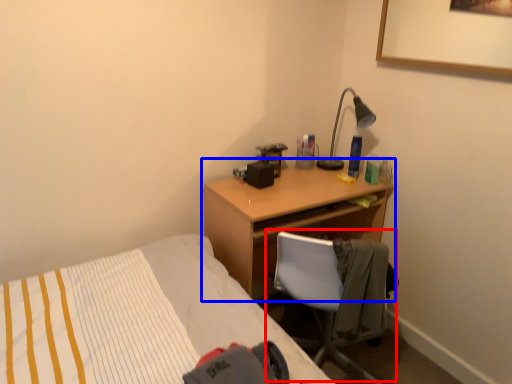
Question: Which of the following is the farthest to the observer, chair (highlighted by a red box) or desk (highlighted by a blue box)?

Choices:
 (A) chair
 (B) desk

Answer: (B)